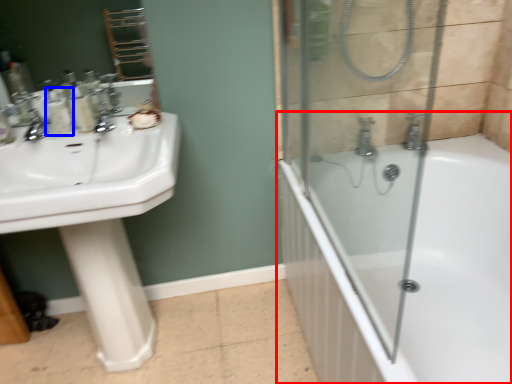
Question: Which point is closer to the camera, bathtub (highlighted by a red box) or toiletry (highlighted by a blue box)?

Choices:
 (A) bathtub
 (B) toiletry

Answer: (A)